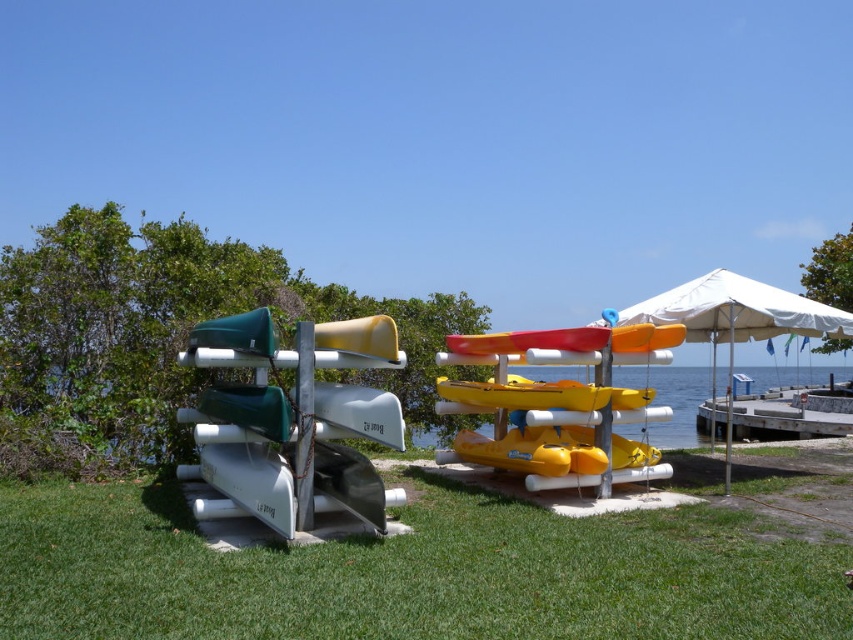
You are standing at the lakeside and see the green grass at center and the green matte kayak at left. Which object is located to the right of the other?

The green grass at center is positioned on the right side of the green matte kayak at left, so the green grass at center is to the right of the green matte kayak at left.